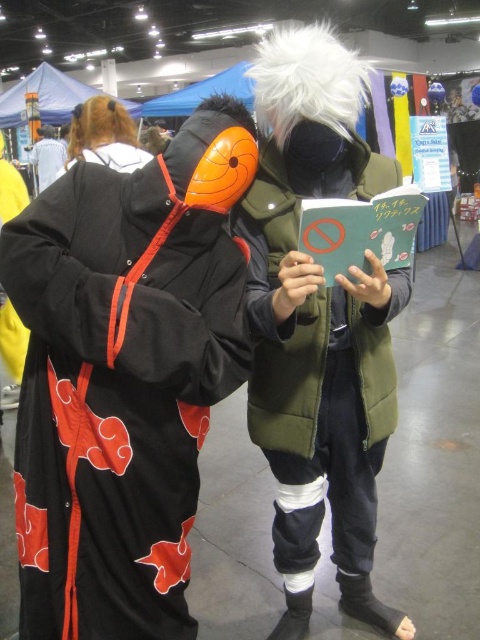
Does black fabric cloak at left have a greater height compared to matte green vest at center?

Incorrect, black fabric cloak at left's height is not larger of matte green vest at center's.

Does black fabric cloak at left appear under matte green vest at center?

Correct, black fabric cloak at left is located below matte green vest at center.

The height and width of the screenshot is (640, 480). Find the location of `black fabric cloak at left`. black fabric cloak at left is located at coordinates (124, 376).

Identify the location of black fabric cloak at left. This screenshot has width=480, height=640. (124, 376).